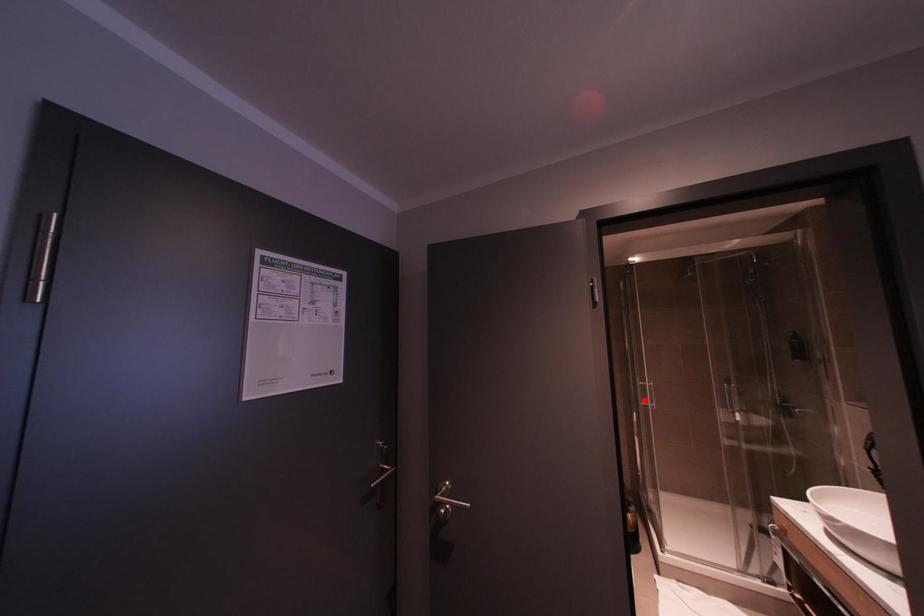
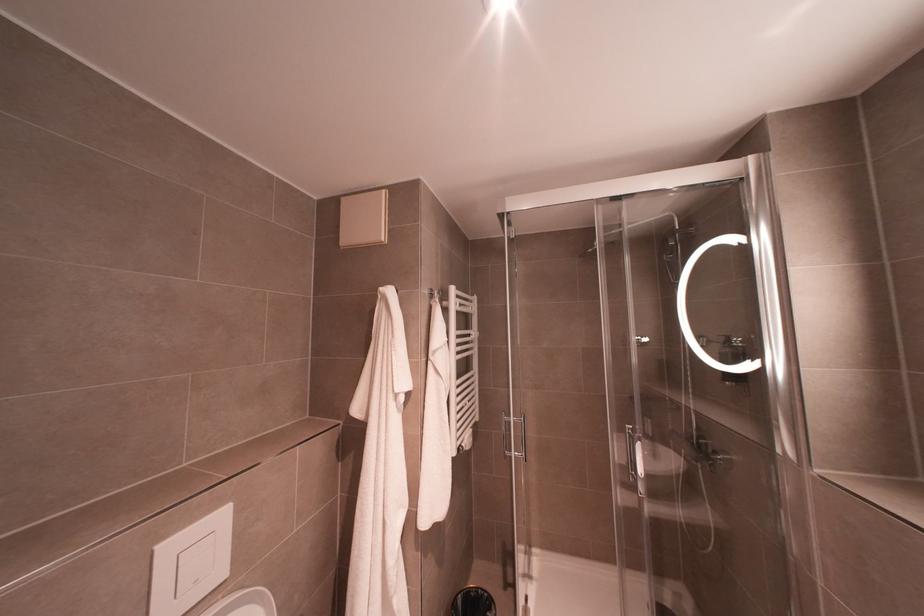
Question: I am providing you with two images of the same scene from different viewpoints. In image1, a red point is highlighted. Considering the same 3D point in image2, which of the following is correct?

Choices:
 (A) It is closer
 (B) It is farther

Answer: (B)